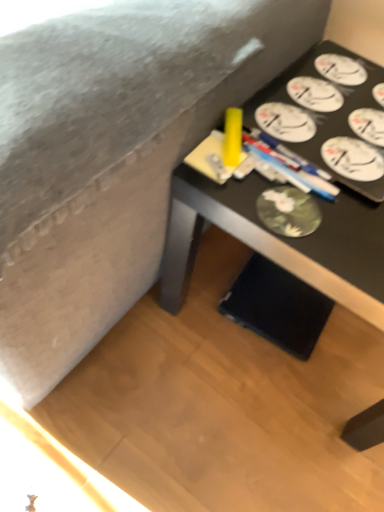
Question: Should I look upward or downward to see black matte desk at lower right?

Choices:
 (A) up
 (B) down

Answer: (A)